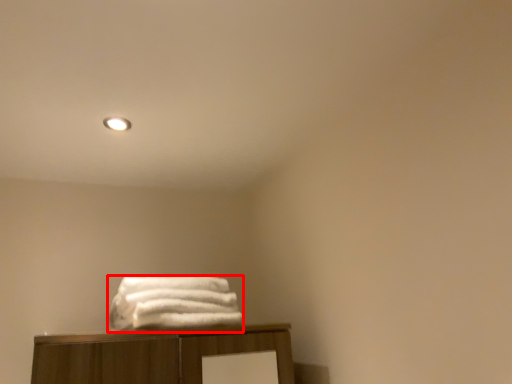
Question: Where is towel (annotated by the red box) located in relation to lighting in the image?

Choices:
 (A) right
 (B) left

Answer: (A)